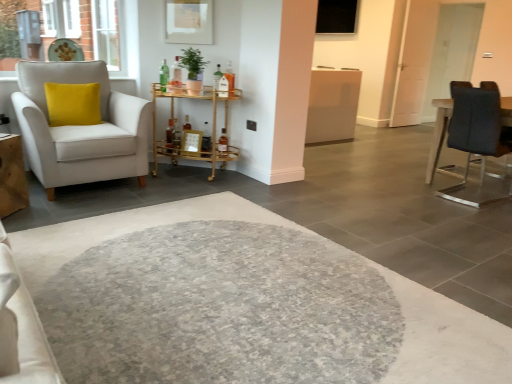
Question: In the image, is yellow velvet pillow at left positioned in front of or behind matte glass bottle at center?

Choices:
 (A) behind
 (B) front

Answer: (B)

Question: Considering the positions of yellow velvet pillow at left and matte glass bottle at center in the image, is yellow velvet pillow at left bigger or smaller than matte glass bottle at center?

Choices:
 (A) big
 (B) small

Answer: (A)

Question: Which is nearer to the dark wood table at right, which is the 1th table in right-to-left order?

Choices:
 (A) yellow velvet pillow at left
 (B) white glossy door at upper right
 (C) black glass window screen at upper center
 (D) matte glass bottle at center
 (E) matte white armchair at left

Answer: (D)

Question: Which of these objects is positioned farthest from the brick wall at upper left?

Choices:
 (A) dark wood table at right, the 2th table when ordered from left to right
 (B) matte glass bottle at center
 (C) yellow velvet pillow at left
 (D) black glass window screen at upper center
 (E) matte white armchair at left

Answer: (D)